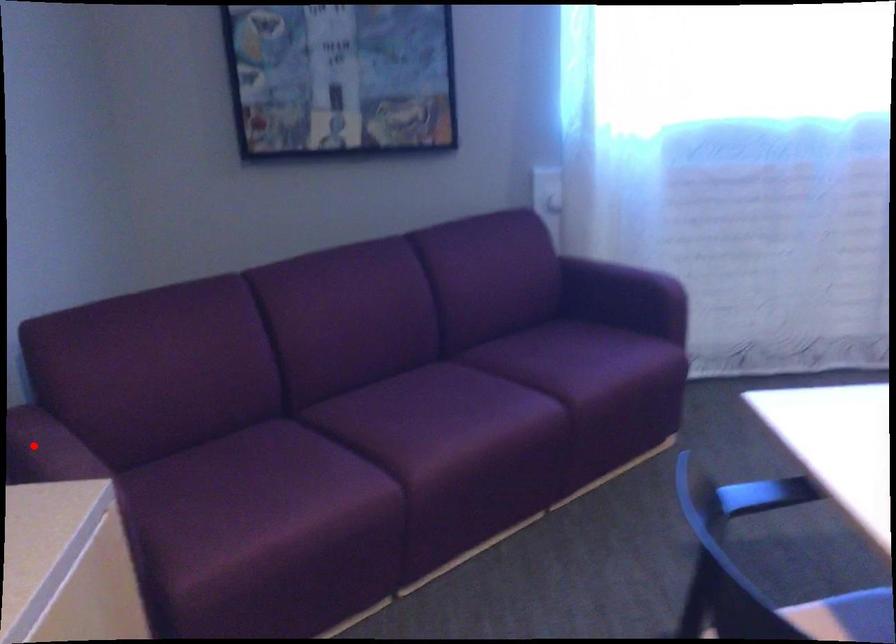
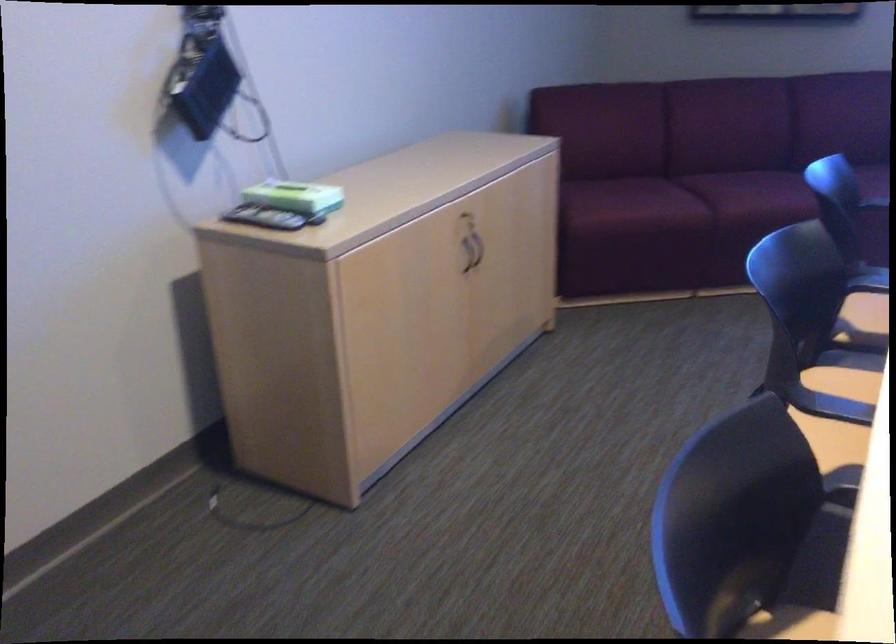
Question: I am providing you with two images of the same scene from different viewpoints. A red point is marked on the first image. At the location where the point appears in image 1, is it still visible in image 2?

Choices:
 (A) Yes
 (B) No

Answer: (B)